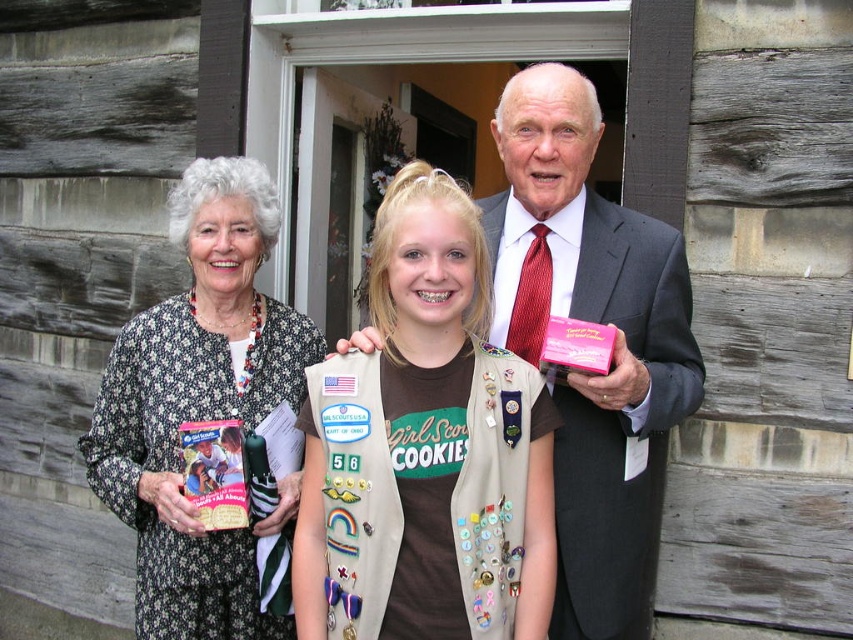
You are an architect designing a layout for a community center. You need to place a bench in the area where the dark gray suit at center is currently located. According to the coordinates provided, what are the exact coordinates where you should position the bench?

The dark gray suit at center is located at point (613,348), so you should position the bench at those exact coordinates.

You are a tailor measuring the clothing of two people standing in front of a rustic wooden building. The first person is wearing a tan Girl Scout vest at center, and the second is wearing a dark gray suit at center. Which clothing item has a greater width?

The tan Girl Scout vest at center has a greater width than the dark gray suit at center according to the description.